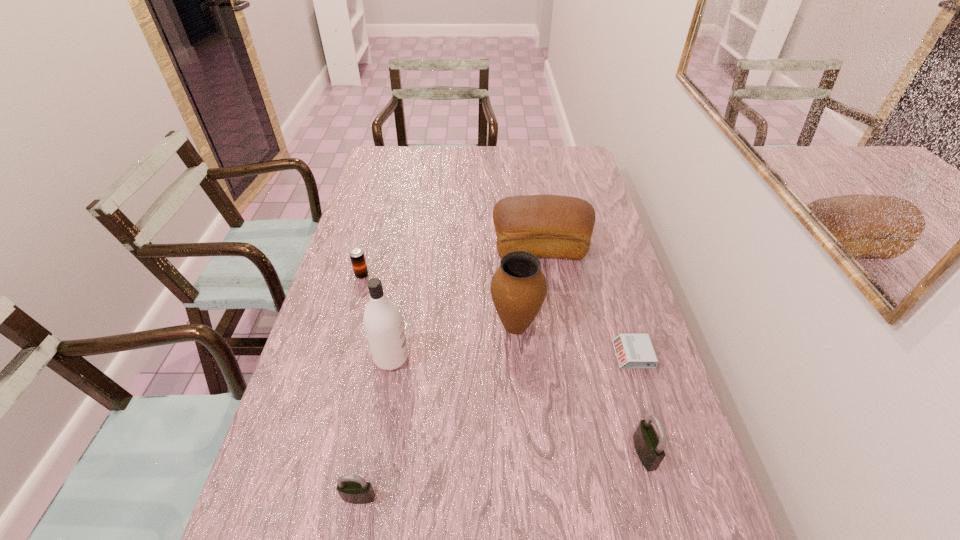
Where is `the nearer padlock`? The width and height of the screenshot is (960, 540). the nearer padlock is located at coordinates (354, 489).

Locate an element on the screen. Image resolution: width=960 pixels, height=540 pixels. the shorter padlock is located at coordinates (354, 489).

Image resolution: width=960 pixels, height=540 pixels. Identify the location of the farther padlock. (649, 446).

You are a GUI agent. You are given a task and a screenshot of the screen. Output one action in this format:
    pyautogui.click(x=<x>, y=<y>)
    Task: Click on the taller padlock
    The height and width of the screenshot is (540, 960).
    Given the screenshot: What is the action you would take?
    pyautogui.click(x=649, y=446)

This screenshot has height=540, width=960. I want to click on beer can, so click(356, 254).

I want to click on the leftmost object, so click(x=356, y=254).

Locate an element on the screen. This screenshot has width=960, height=540. the farthest object is located at coordinates (549, 226).

Identify the location of the fifth shortest object. (549, 226).

Where is `urn`? urn is located at coordinates (518, 288).

You are a GUI agent. You are given a task and a screenshot of the screen. Output one action in this format:
    pyautogui.click(x=<x>, y=<y>)
    Task: Click on the alarm clock
    Image resolution: width=960 pixels, height=540 pixels.
    Given the screenshot: What is the action you would take?
    pyautogui.click(x=634, y=351)